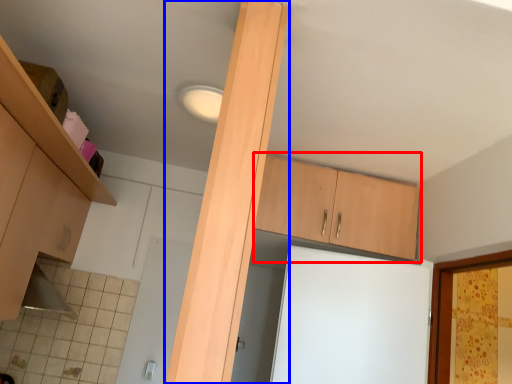
Question: Which of the following is the closest to the observer, cabinetry (highlighted by a red box) or beam (highlighted by a blue box)?

Choices:
 (A) cabinetry
 (B) beam

Answer: (B)